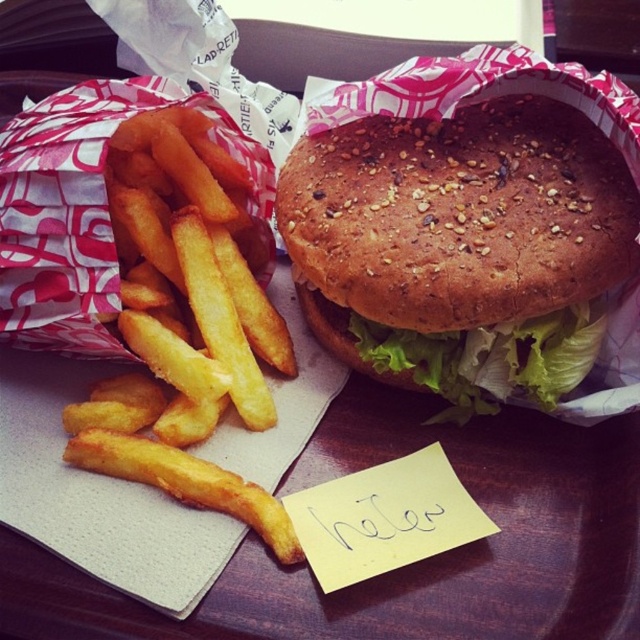
You are a food critic evaluating this meal. You notice the sesame seed bun at center and the green leafy lettuce at center. Which of these two items is located more to the left?

The sesame seed bun at center is positioned on the left side of green leafy lettuce at center, so it is more to the left.

You are taking a photo of the meal and want to focus on the burger and the fries. Which of the two points, point (x=340, y=220) or point (x=278, y=316), is closer to the camera and should be used for focusing on the burger and fries?

Point (x=340, y=220) is closer to the camera than point (x=278, y=316), so it should be used for focusing on the burger and fries.

You are a photographer adjusting your camera to capture the meal. You notice two points marked at coordinates point (x=161, y=400) and point (x=532, y=362). Which point should you focus on first if you want to ensure the closer one is in sharp focus?

Point (x=161, y=400) is closer to the camera than point (x=532, y=362), so you should focus on point (x=161, y=400) first to ensure it is in sharp focus.